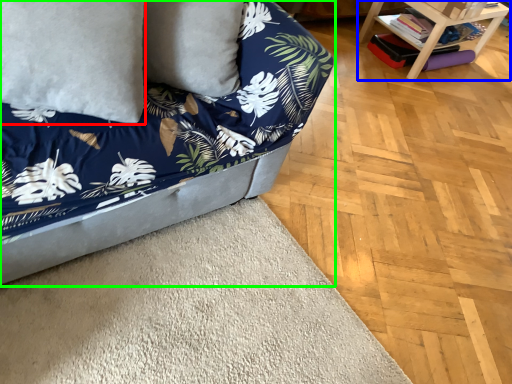
Question: Which is farther away from pillow (highlighted by a red box)? table (highlighted by a blue box) or studio couch (highlighted by a green box)?

Choices:
 (A) table
 (B) studio couch

Answer: (A)